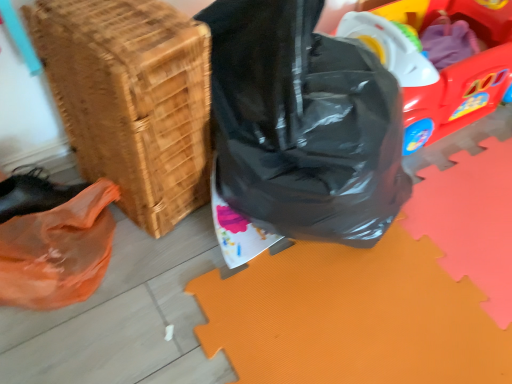
Question: Is point (125, 130) positioned closer to the camera than point (317, 86)?

Choices:
 (A) closer
 (B) farther

Answer: (A)

Question: Is woven wood basket at lower left in front of or behind black plastic bag at center in the image?

Choices:
 (A) behind
 (B) front

Answer: (A)

Question: Which object is positioned closest to the rubberized plastic wagon at upper right?

Choices:
 (A) black plastic bag at center
 (B) woven wood basket at lower left

Answer: (A)

Question: Which object is the farthest from the woven wood basket at lower left?

Choices:
 (A) rubberized plastic wagon at upper right
 (B) black plastic bag at center

Answer: (A)